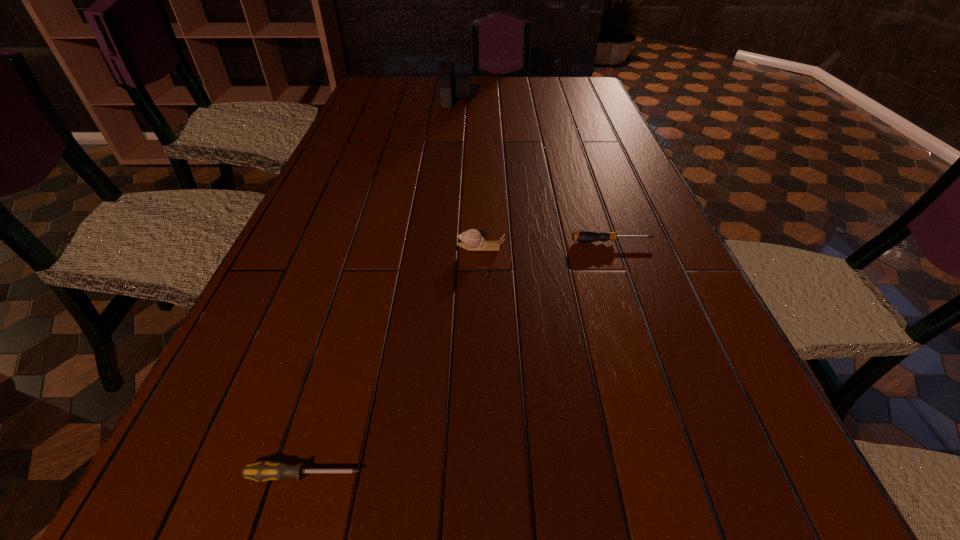
At what (x,y) coordinates should I click in order to perform the action: click on camera. Please return your answer as a coordinate pair (x, y). The image size is (960, 540). Looking at the image, I should click on (459, 87).

Locate an element on the screen. the farthest object is located at coordinates (459, 87).

Identify the location of escargot. (472, 240).

Where is `the rightmost object`? The height and width of the screenshot is (540, 960). the rightmost object is located at coordinates (584, 236).

Locate an element on the screen. The height and width of the screenshot is (540, 960). the right screwdriver is located at coordinates (584, 236).

Find the location of a particular element. The width and height of the screenshot is (960, 540). the left screwdriver is located at coordinates (265, 470).

Locate an element on the screen. The image size is (960, 540). the nearest object is located at coordinates (265, 470).

Where is `vacant space situated 0.130m at the lens of the camera`? vacant space situated 0.130m at the lens of the camera is located at coordinates (505, 100).

You are a GUI agent. You are given a task and a screenshot of the screen. Output one action in this format:
    pyautogui.click(x=<x>, y=<y>)
    Task: Click on the vacant space located 0.240m on the shell of the second tallest object
    The height and width of the screenshot is (540, 960).
    Given the screenshot: What is the action you would take?
    pyautogui.click(x=351, y=248)

Where is `vacant space situated on the shell of the second tallest object`? The width and height of the screenshot is (960, 540). vacant space situated on the shell of the second tallest object is located at coordinates (396, 248).